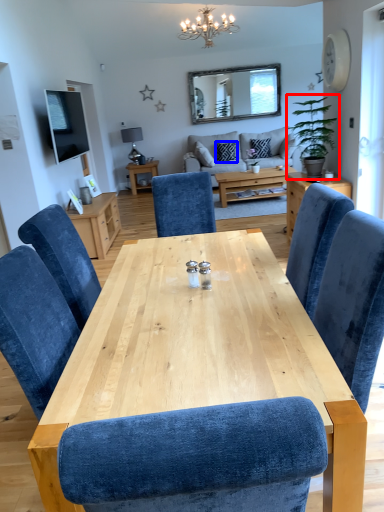
Question: Which object is further to the camera taking this photo, houseplant (highlighted by a red box) or pillow (highlighted by a blue box)?

Choices:
 (A) houseplant
 (B) pillow

Answer: (B)